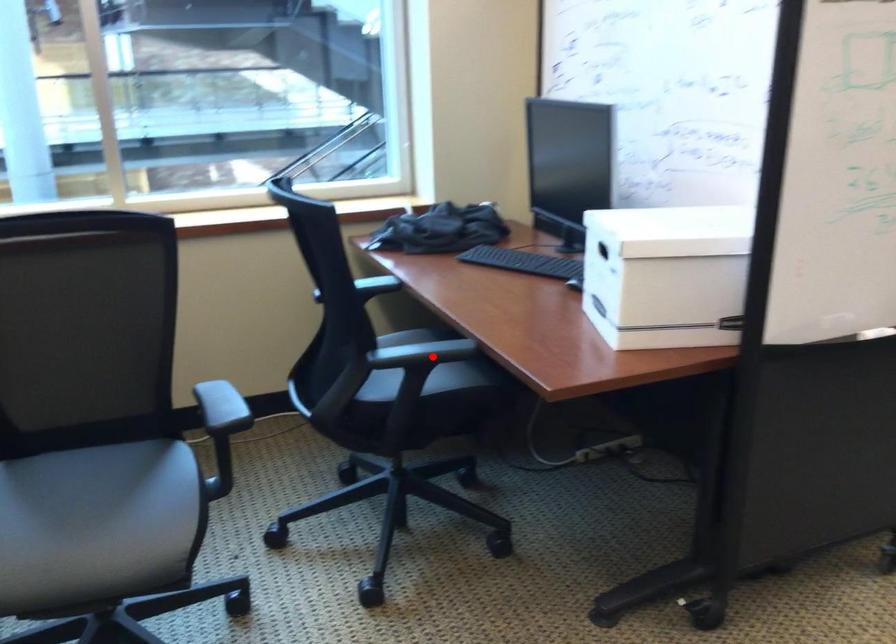
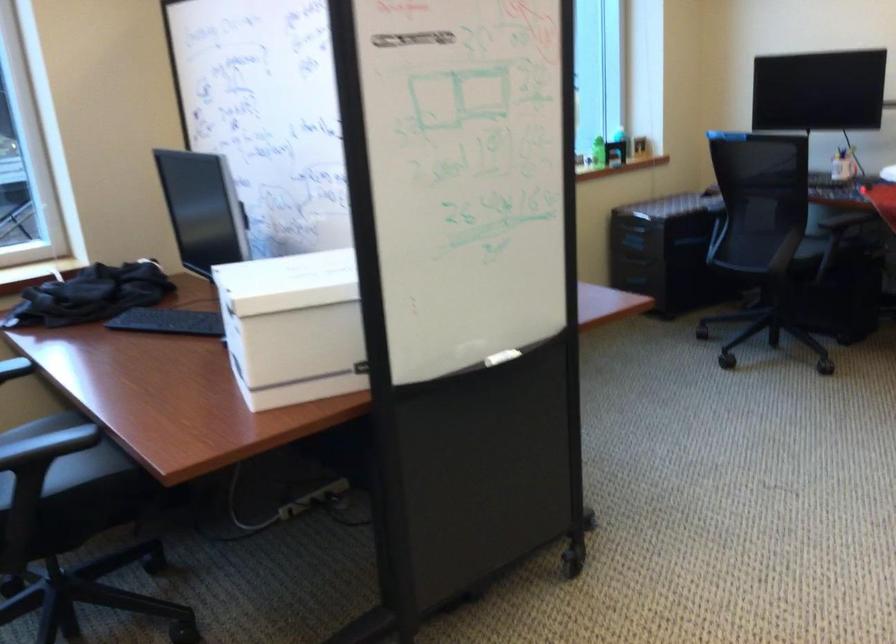
Question: I am providing you with two images of the same scene from different viewpoints. In image1, a red point is highlighted. Considering the same 3D point in image2, which of the following is correct?

Choices:
 (A) It is closer
 (B) It is farther

Answer: (A)